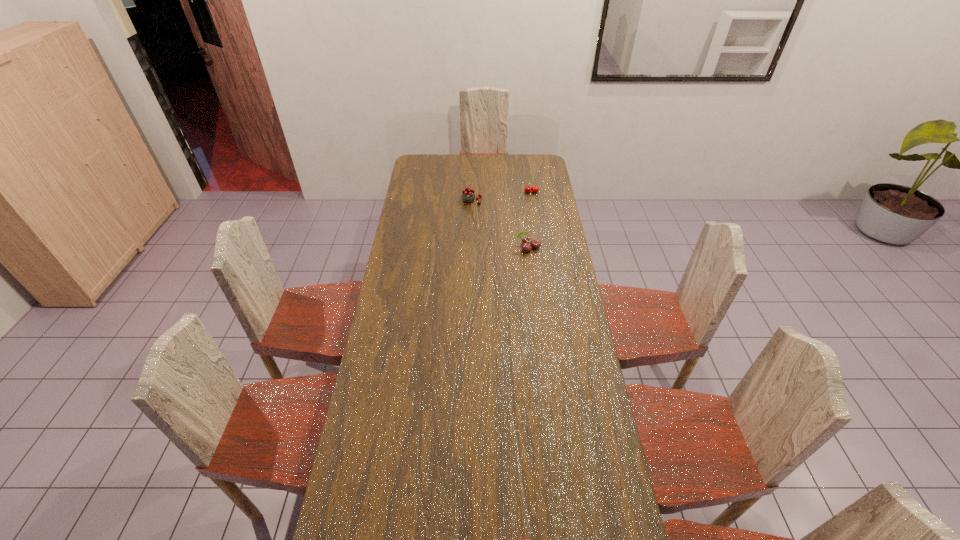
Image resolution: width=960 pixels, height=540 pixels. I want to click on free region at the far right corner, so click(523, 164).

Locate an element on the screen. This screenshot has height=540, width=960. vacant area that lies between the nearest cherry and the third nearest object is located at coordinates (500, 225).

Where is `the second closest object relative to the third farthest object`? The height and width of the screenshot is (540, 960). the second closest object relative to the third farthest object is located at coordinates (535, 189).

The image size is (960, 540). I want to click on object that stands as the closest to the nearest cherry, so click(468, 195).

In order to click on the closest cherry relative to the nearest object in this screenshot , I will do `click(526, 240)`.

This screenshot has height=540, width=960. Find the location of `cherry that can be found as the closest to the farthest cherry`. cherry that can be found as the closest to the farthest cherry is located at coordinates (468, 195).